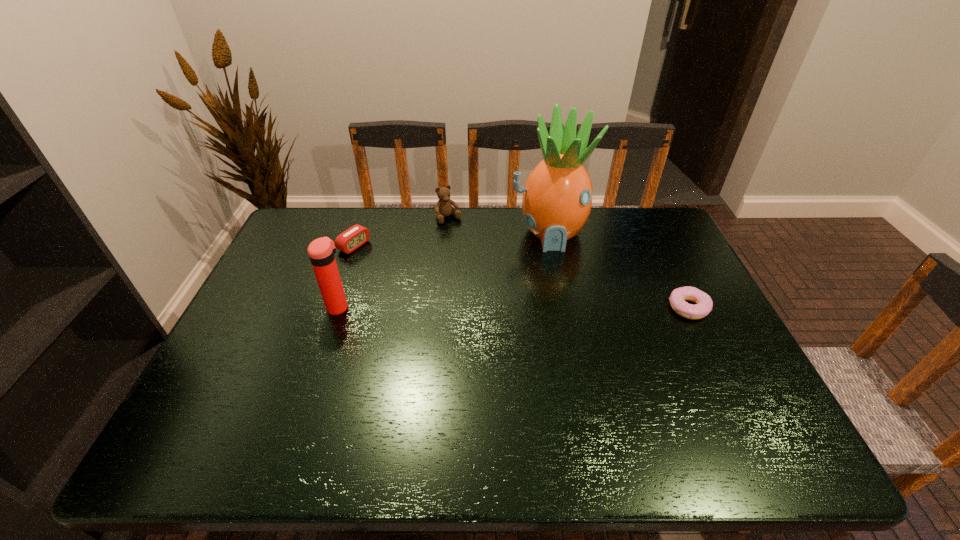
Identify which object is the second closest to the thermos bottle. Please provide its 2D coordinates. Your answer should be formatted as a tuple, i.e. [(x, y)], where the tuple contains the x and y coordinates of a point satisfying the conditions above.

[(443, 208)]

Locate which object is the third closest to the teddy bear. Please provide its 2D coordinates. Your answer should be formatted as a tuple, i.e. [(x, y)], where the tuple contains the x and y coordinates of a point satisfying the conditions above.

[(321, 251)]

Find the location of a particular element. The image size is (960, 540). free spot that satisfies the following two spatial constraints: 1. on the front side of the fourth tallest object; 2. on the right side of the fourth shortest object is located at coordinates (333, 307).

What are the coordinates of `vacant space that satisfies the following two spatial constraints: 1. on the front side of the fourth object from left to right; 2. on the left side of the doughnut` in the screenshot? It's located at (564, 308).